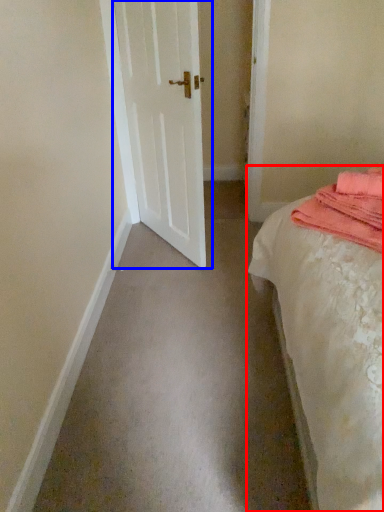
Question: Which object is further to the camera taking this photo, bed (highlighted by a red box) or door (highlighted by a blue box)?

Choices:
 (A) bed
 (B) door

Answer: (B)